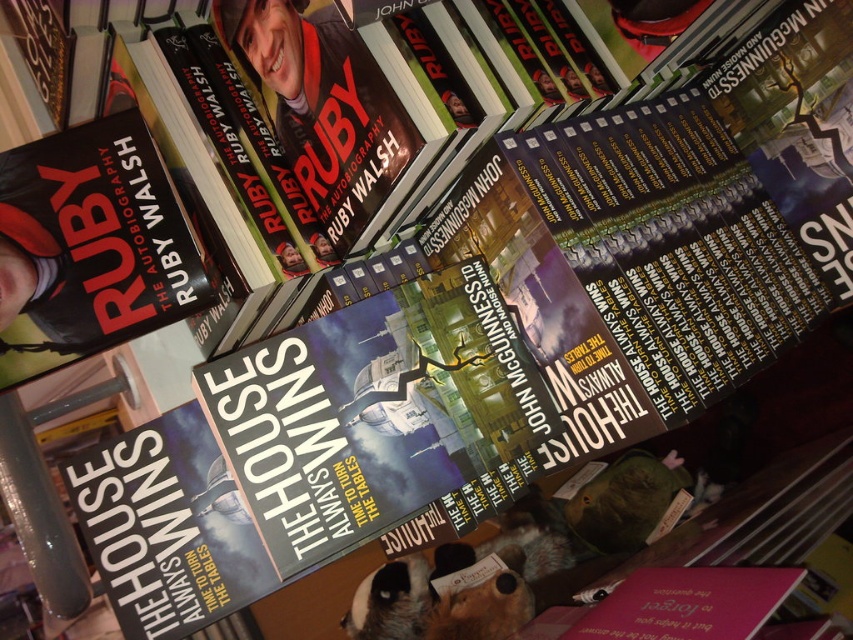
Based on the scene description, where is the matte black book at upper left located in terms of coordinates?

The matte black book at upper left is located at point coordinates of (x=90, y=246).

You are a customer in the bookstore and want to reach the book at point (x=126, y=529). There is an obstacle at point (x=131, y=314). Can you walk around it to get to your desired book?

Point (x=131, y=314) is in front of point (x=126, y=529). Therefore, you must navigate around the obstacle at point (x=131, y=314) to reach your desired book at point (x=126, y=529).